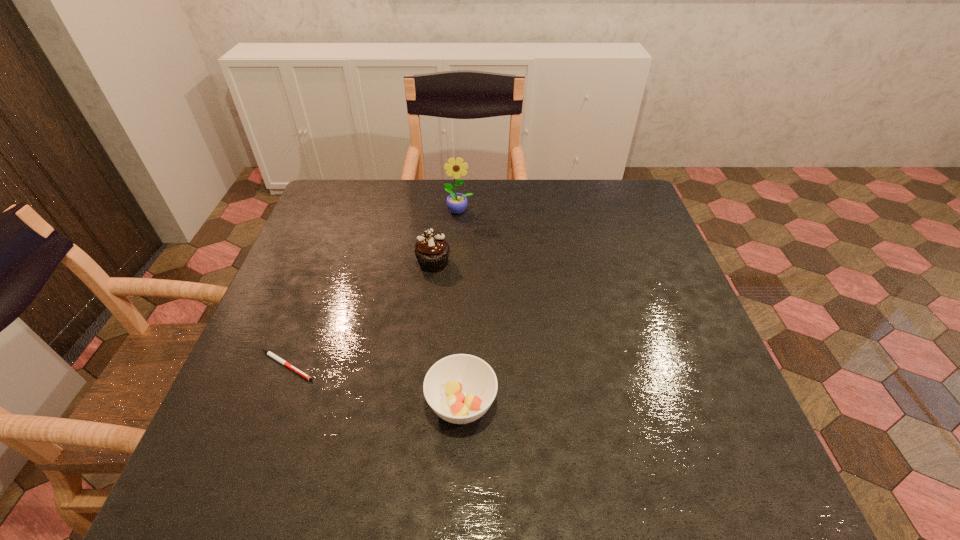
Identify the location of vacant region between the third shortest object and the soup bowl. Image resolution: width=960 pixels, height=540 pixels. (447, 333).

Where is `vacant space that is in between the second farthest object and the pen`? The height and width of the screenshot is (540, 960). vacant space that is in between the second farthest object and the pen is located at coordinates (360, 314).

Find the location of a particular element. The height and width of the screenshot is (540, 960). vacant area between the sunflower and the soup bowl is located at coordinates (461, 307).

You are a GUI agent. You are given a task and a screenshot of the screen. Output one action in this format:
    pyautogui.click(x=<x>, y=<y>)
    Task: Click on the vacant area between the farthest object and the second farthest object
    Image resolution: width=960 pixels, height=540 pixels.
    Given the screenshot: What is the action you would take?
    pyautogui.click(x=446, y=237)

The height and width of the screenshot is (540, 960). In order to click on vacant area between the leftmost object and the cupcake in this screenshot , I will do `click(360, 314)`.

Locate an element on the screen. This screenshot has width=960, height=540. vacant space that is in between the second shortest object and the farthest object is located at coordinates (461, 307).

The height and width of the screenshot is (540, 960). What are the coordinates of `empty space that is in between the pen and the sunflower` in the screenshot? It's located at (373, 288).

Identify the location of free space between the sunflower and the third nearest object. This screenshot has height=540, width=960. (446, 237).

Where is `vacant area between the pen and the cupcake`? The image size is (960, 540). vacant area between the pen and the cupcake is located at coordinates (360, 314).

Find the location of a particular element. The height and width of the screenshot is (540, 960). free space between the third shortest object and the soup bowl is located at coordinates (447, 333).